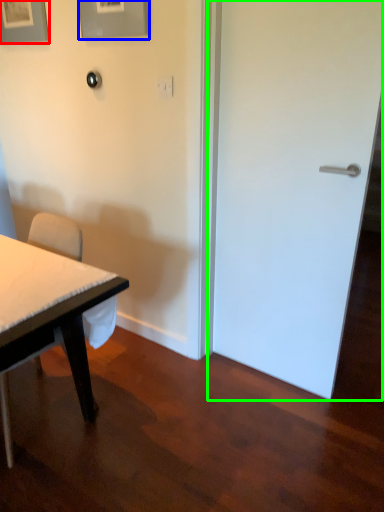
Question: Considering the real-world distances, which object is closest to picture frame (highlighted by a red box)? picture frame (highlighted by a blue box) or door (highlighted by a green box).

Choices:
 (A) picture frame
 (B) door

Answer: (A)